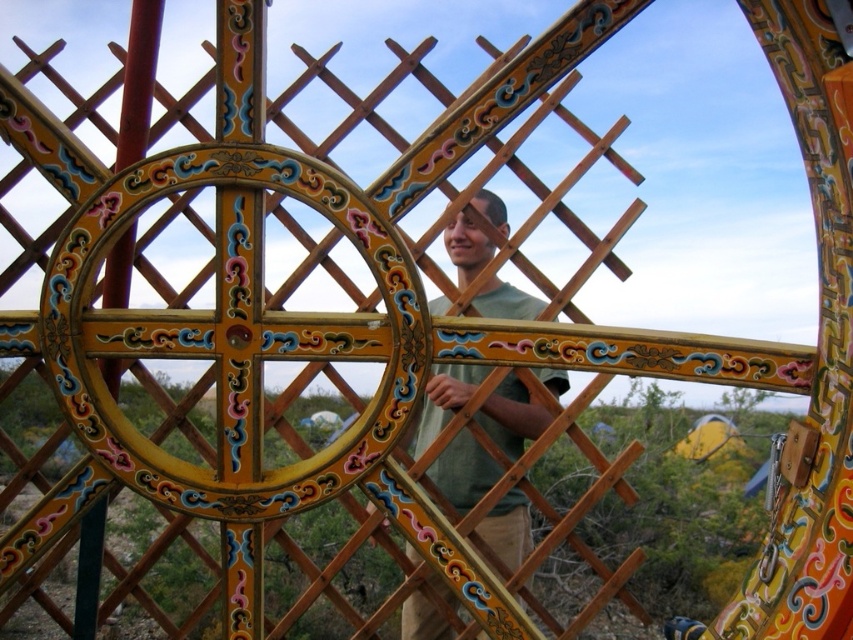
Looking at this image, you are standing in the middle of the wooden structure and want to place a 2.5 feet wide decorative item between the wooden lattice at center and the green matte shirt at center. Is there enough space between them to fit the item?

The wooden lattice at center is 41.54 feet away from the green matte shirt at center. Since the decorative item is only 2.5 feet wide, there is more than enough space to place it between them.

You are an interior designer observing the vibrant wooden structure. You notice the wooden lattice at center and the green matte shirt at center. Which object is positioned to the left in this design?

The wooden lattice at center is positioned to the left of the green matte shirt at center.

You are a visitor at a cultural exhibition and you see the wooden lattice at center and the green matte shirt at center displayed together. Which object takes up more space in the image?

The wooden lattice at center is larger in size than the green matte shirt at center, so it takes up more space in the image.